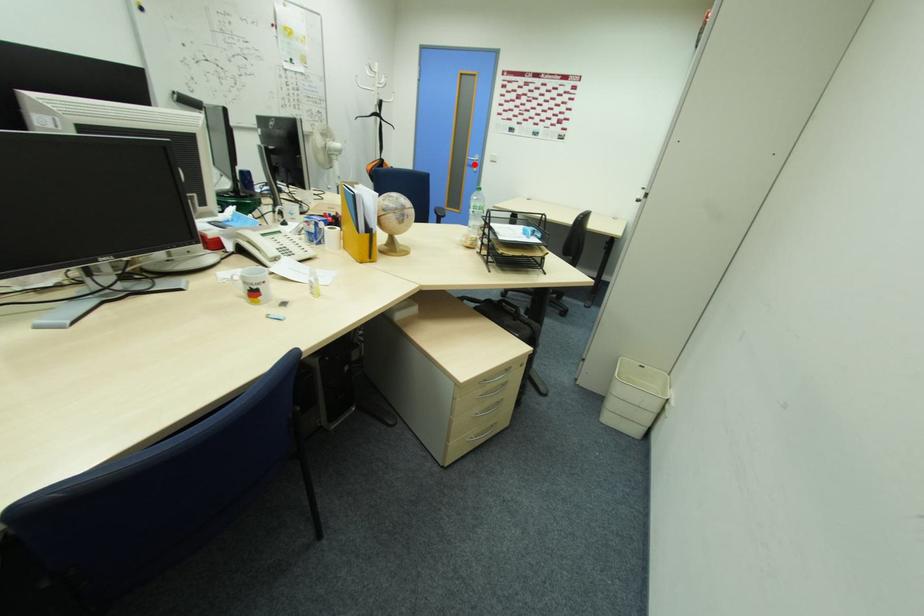
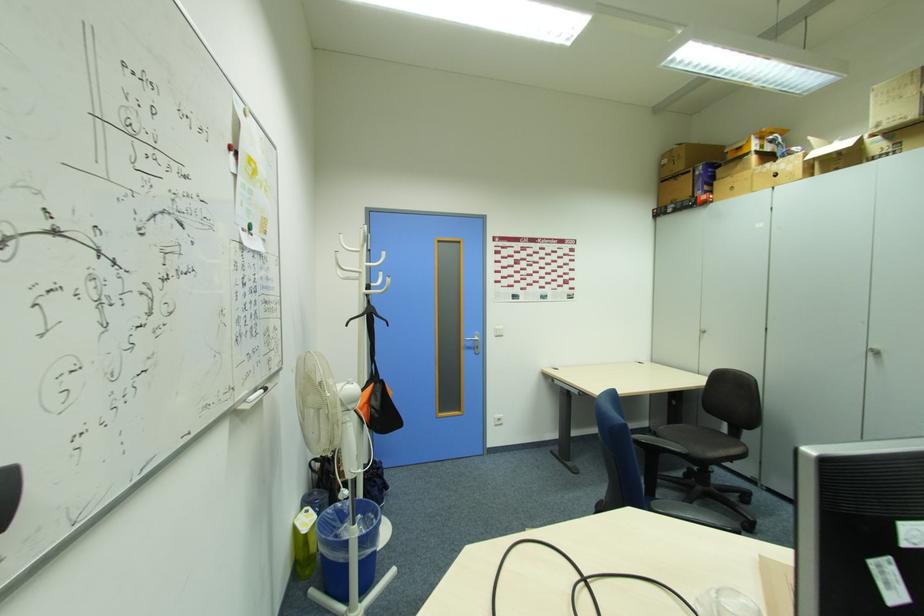
Question: I am providing you with two images of the same scene from different viewpoints. A red point is marked on the first image. Can you still see the location of the red point in image 2?

Choices:
 (A) Yes
 (B) No

Answer: (A)